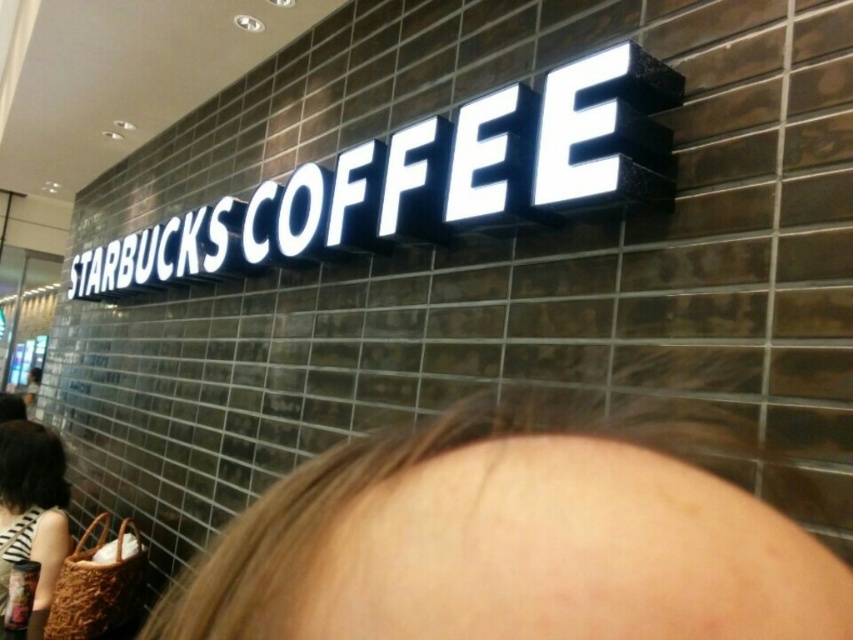
Can you confirm if white glossy sign at center is positioned to the left of striped fabric bag at lower left?

In fact, white glossy sign at center is to the right of striped fabric bag at lower left.

Can you confirm if white glossy sign at center is positioned above striped fabric bag at lower left?

Yes, white glossy sign at center is above striped fabric bag at lower left.

This screenshot has height=640, width=853. Identify the location of white glossy sign at center. (427, 179).